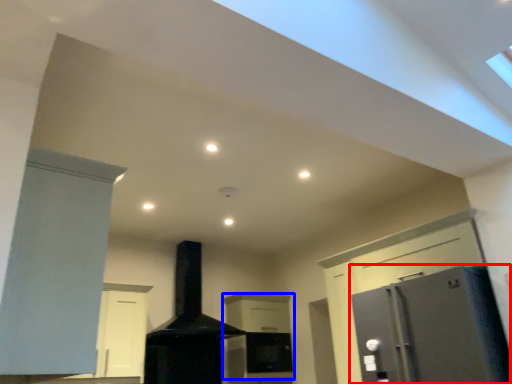
Question: Which point is further to the camera, refrigerator (highlighted by a red box) or cabinetry (highlighted by a blue box)?

Choices:
 (A) refrigerator
 (B) cabinetry

Answer: (B)